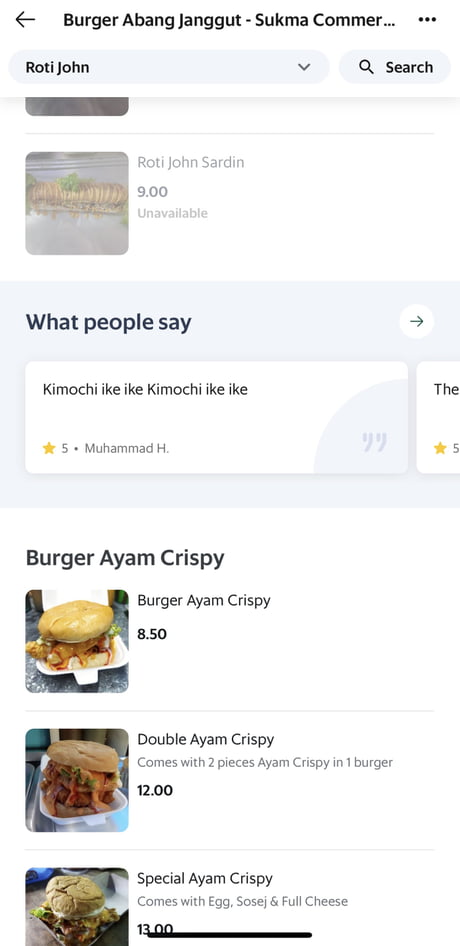
I want to click on counter, so click(x=32, y=932), click(x=111, y=684).